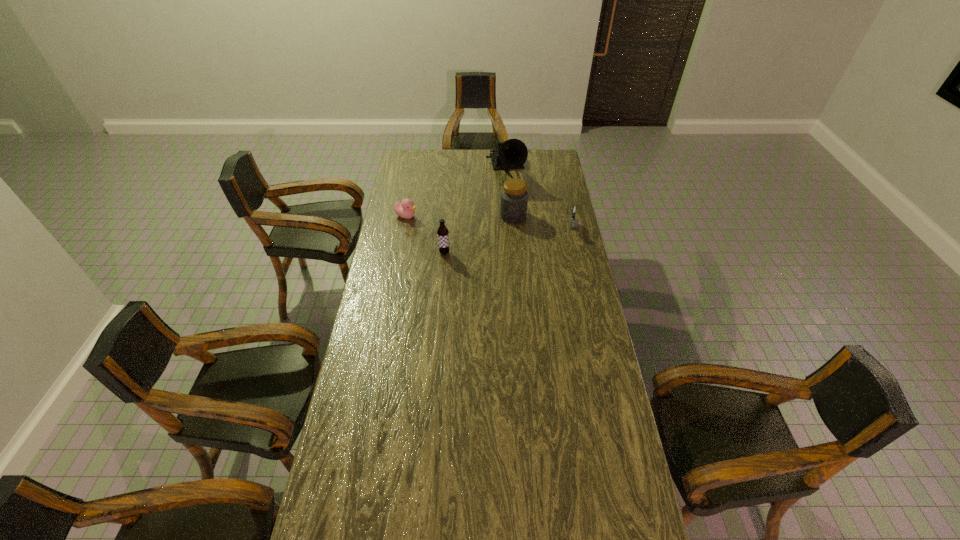
Locate an element on the screen. This screenshot has height=540, width=960. the nearest object is located at coordinates (442, 233).

Identify the location of the second object from left to right. (442, 233).

Locate an element on the screen. This screenshot has height=540, width=960. the rightmost object is located at coordinates (573, 209).

Locate an element on the screen. duckling is located at coordinates (405, 209).

Identify the location of the leftmost object. (405, 209).

This screenshot has height=540, width=960. I want to click on the farthest object, so click(x=512, y=154).

Where is `the tallest object`? Image resolution: width=960 pixels, height=540 pixels. the tallest object is located at coordinates (512, 154).

Identify the location of jar. (514, 197).

Locate an element on the screen. Image resolution: width=960 pixels, height=540 pixels. free point located on the back of the root beer is located at coordinates (448, 204).

At what (x,y) coordinates should I click in order to perform the action: click on vacant position located on the back of the rightmost object. Please return your answer as a coordinate pair (x, y). Looking at the image, I should click on (560, 176).